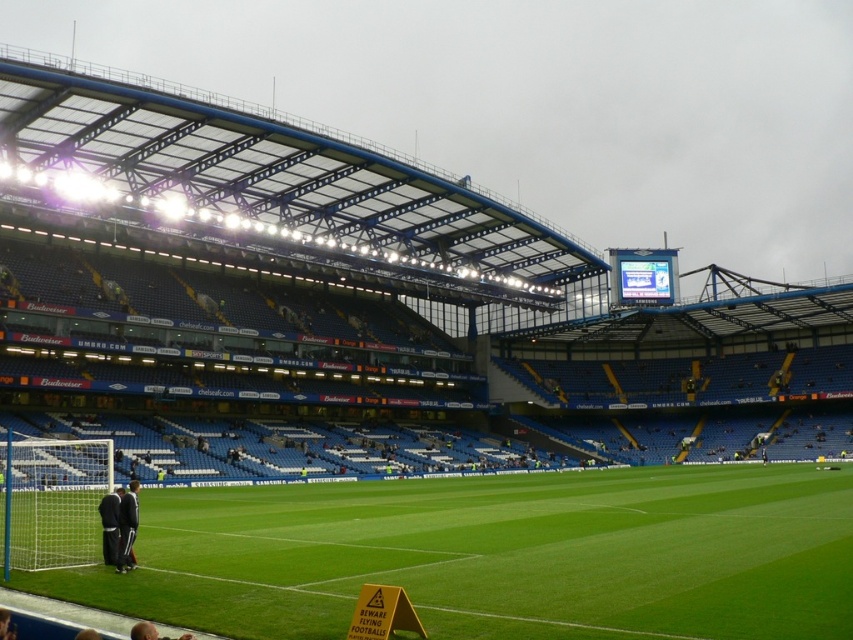
You are a photographer positioned at the center of the stadium field. You need to capture a photo that includes both the dark gray tracksuit at lower left and the dark blue jersey at lower left. Since you want to ensure both are visible, which object should you focus on first to get the best depth of field?

The dark gray tracksuit at lower left is thinner than the dark blue jersey at lower left, so you should focus on the dark blue jersey at lower left first because thicker objects generally require focusing on them to ensure both foreground and background elements are sharp in the photo.

You are a photographer standing at the edge of the football pitch. You want to take a photo of the dark blue jersey at lower left without the white mesh net at lower left appearing in the foreground. Is this possible based on their positions?

The white mesh net at lower left is located below the dark blue jersey at lower left. Since the net is below the jersey, positioning yourself so that the jersey is framed without the net in front would require angling the camera upwards to avoid the net, which is positioned lower. This should be achievable as the net is beneath the jersey, not in front of it.